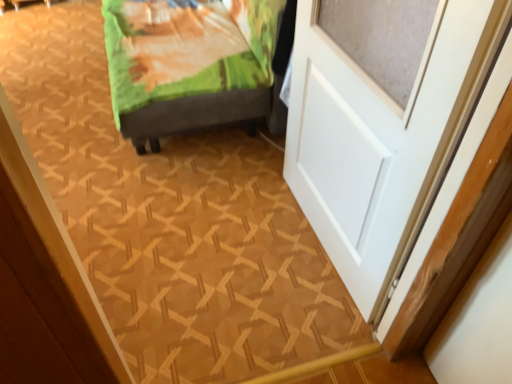
Locate an element on the screen. Image resolution: width=512 pixels, height=384 pixels. vacant area situated below white matte door at right (from a real-world perspective) is located at coordinates (319, 249).